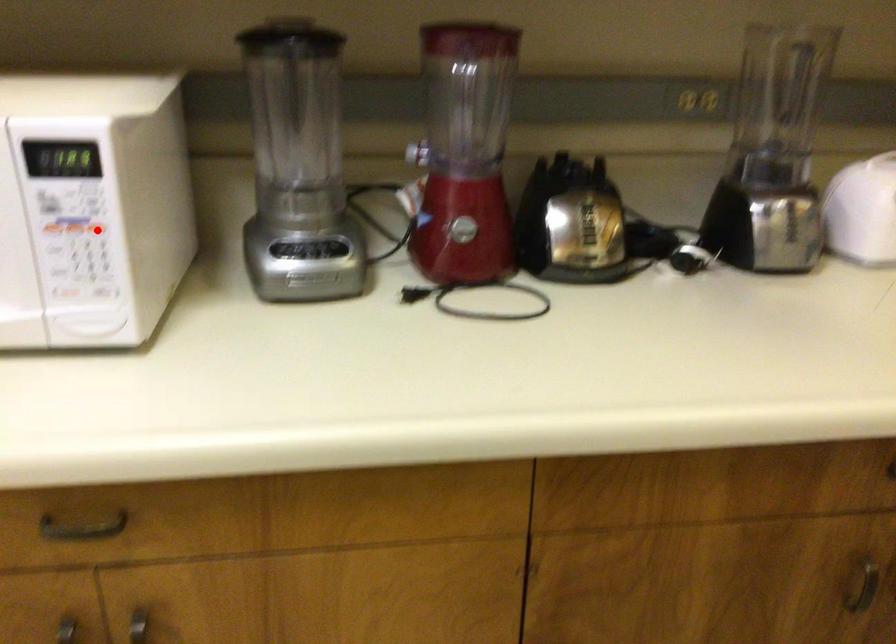
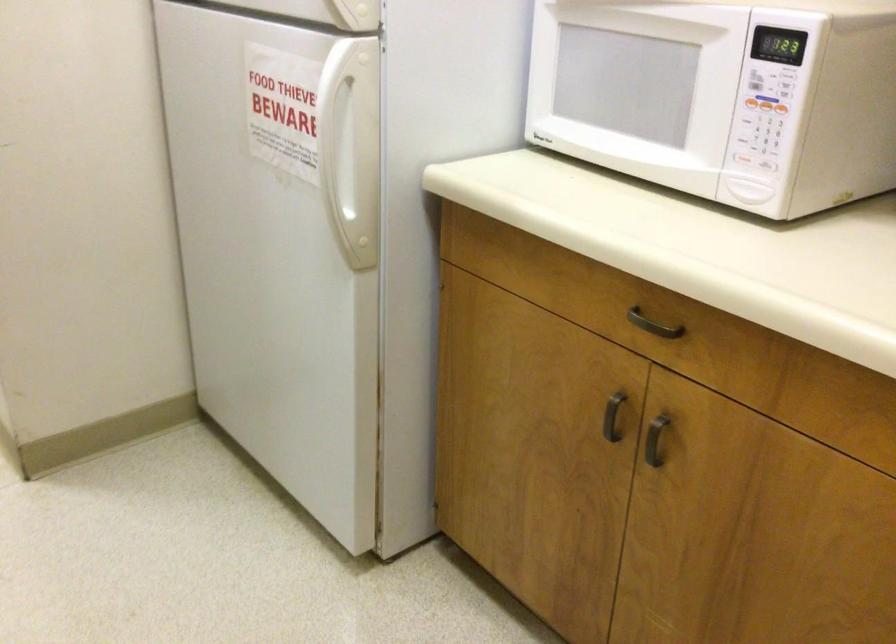
In the second image, find the point that corresponds to the highlighted location in the first image.

(780, 108)